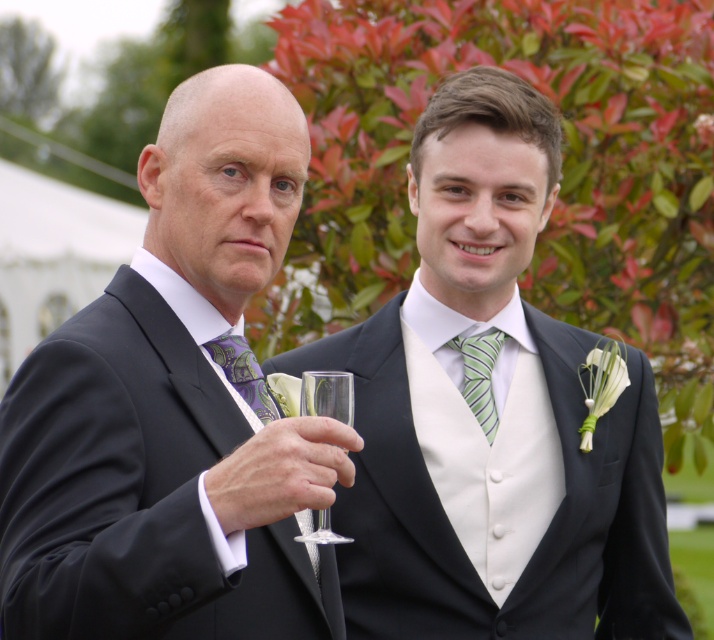
Which is above, matte black suit at right or purple paisley tie at center?

matte black suit at right is above.

Which is in front, point (446, 216) or point (261, 392)?

Positioned in front is point (261, 392).

The height and width of the screenshot is (640, 714). I want to click on matte black suit at right, so click(x=497, y=416).

Between point (308, 388) and point (467, 385), which one is positioned in front?

Point (308, 388) is in front.

Which is below, clear glass wine glass at center or green striped tie at center?

clear glass wine glass at center is lower down.

Describe the element at coordinates (326, 394) in the screenshot. I see `clear glass wine glass at center` at that location.

At what (x,y) coordinates should I click in order to perform the action: click on clear glass wine glass at center. Please return your answer as a coordinate pair (x, y). The width and height of the screenshot is (714, 640). Looking at the image, I should click on (326, 394).

Looking at this image, who is taller, matte black suit at right or green striped tie at center?

With more height is matte black suit at right.

Is matte black suit at right wider than green striped tie at center?

Correct, the width of matte black suit at right exceeds that of green striped tie at center.

Identify the location of matte black suit at right. The height and width of the screenshot is (640, 714). (497, 416).